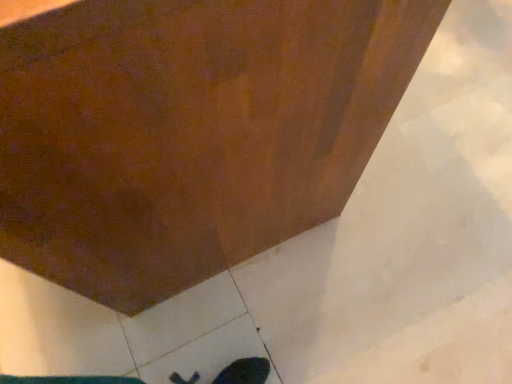
What do you see at coordinates (189, 131) in the screenshot?
I see `matte brown cabinet at lower left` at bounding box center [189, 131].

Where is `matte brown cabinet at lower left`? The height and width of the screenshot is (384, 512). matte brown cabinet at lower left is located at coordinates (189, 131).

What is the approximate width of matte brown cabinet at lower left?

4.21 feet.

Measure the distance between point (278,239) and camera.

3.60 feet.

Identify the location of matte brown cabinet at lower left. This screenshot has height=384, width=512. (189, 131).